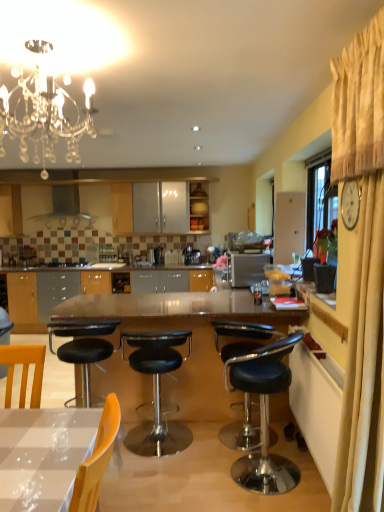
Question: Looking at their shapes, would you say beige fabric curtain at right is wider or thinner than satin silver toaster at center?

Choices:
 (A) thin
 (B) wide

Answer: (A)

Question: Does point (382, 377) appear closer or farther from the camera than point (243, 259)?

Choices:
 (A) closer
 (B) farther

Answer: (A)

Question: Which object is positioned closest to the black leather stool at lower right, the second chair in the back-to-front sequence?

Choices:
 (A) satin silver toaster at center
 (B) crystal glass chandelier at upper left
 (C) satin silver range hood at upper center
 (D) satin silver coffee machine at center
 (E) black leather stool at center, the 1th chair when ordered from back to front

Answer: (E)

Question: Which is farther from the transparent glass table at center?

Choices:
 (A) satin silver range hood at upper center
 (B) satin silver toaster at center
 (C) black leather stool at lower right, which is counted as the first chair, starting from the front
 (D) matte wood cabinet at center
 (E) satin silver coffee machine at center

Answer: (A)